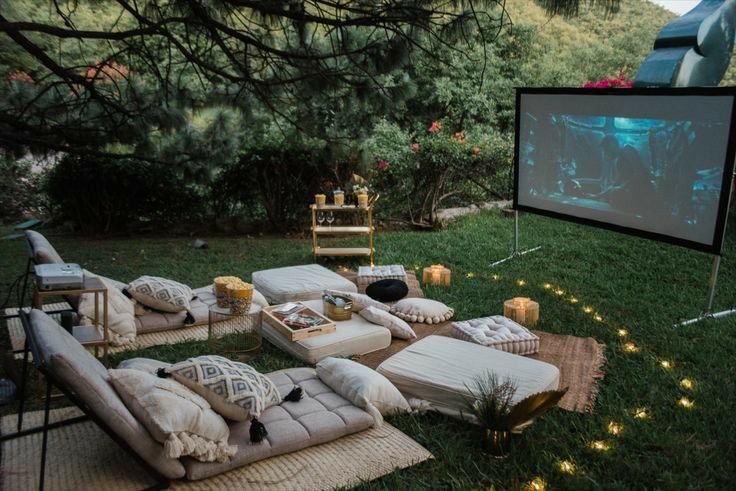
Locate an element on the screen. The width and height of the screenshot is (736, 491). candles is located at coordinates (431, 271), (520, 307), (363, 200), (343, 196), (325, 198).